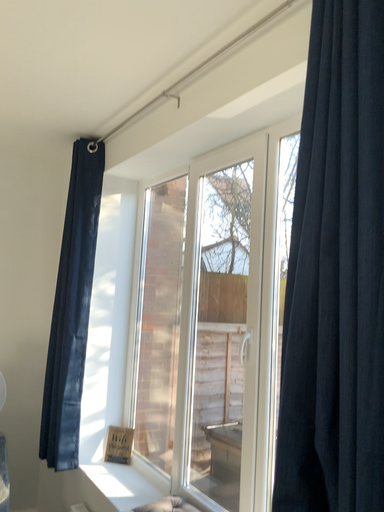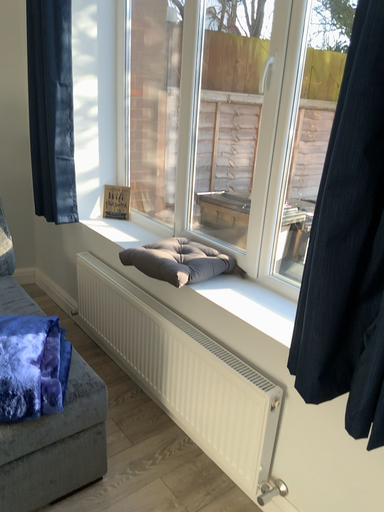
Question: Which way did the camera rotate in the video?

Choices:
 (A) rotated upward
 (B) rotated downward

Answer: (B)